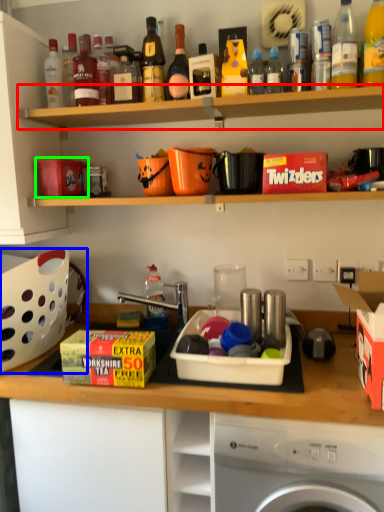
Question: Estimate the real-world distances between objects in this image. Which object is farther from shelf (highlighted by a red box), basket (highlighted by a blue box) or box (highlighted by a green box)?

Choices:
 (A) basket
 (B) box

Answer: (A)